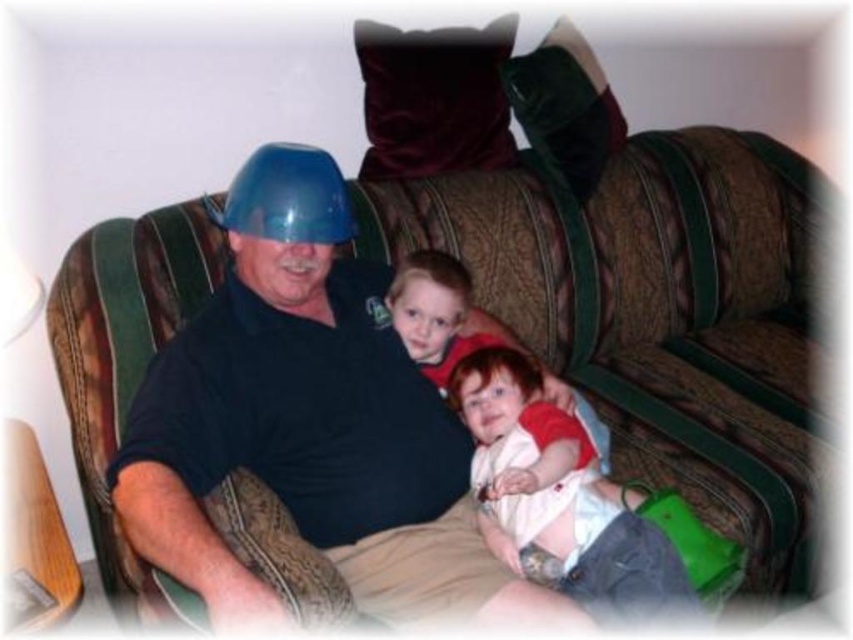
Question: Estimate the real-world distances between objects in this image. Which object is closer to the blue plastic helmet at center?

Choices:
 (A) white cotton shirt at center
 (B) brown fabric couch at center

Answer: (A)

Question: Does white cotton shirt at center have a larger size compared to blue plastic helmet at center?

Choices:
 (A) no
 (B) yes

Answer: (B)

Question: Which object appears closest to the camera in this image?

Choices:
 (A) blue plastic helmet at center
 (B) brown fabric couch at center
 (C) white cotton shirt at center

Answer: (C)

Question: Which is nearer to the brown fabric couch at center?

Choices:
 (A) white cotton shirt at center
 (B) blue plastic helmet at center

Answer: (A)

Question: Can you confirm if brown fabric couch at center is positioned above blue plastic helmet at center?

Choices:
 (A) yes
 (B) no

Answer: (B)

Question: Is brown fabric couch at center below white cotton shirt at center?

Choices:
 (A) no
 (B) yes

Answer: (A)